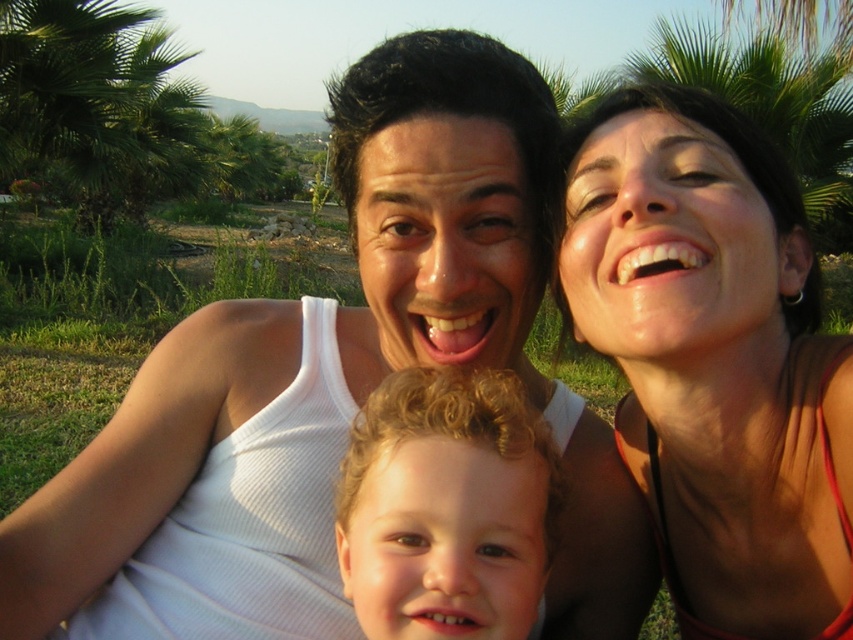
Who is more forward, (68, 515) or (598, 323)?

Point (598, 323) is more forward.

Does white ribbed tank top at center appear over matte red tank top at upper right?

No, white ribbed tank top at center is not above matte red tank top at upper right.

What do you see at coordinates (334, 388) in the screenshot? This screenshot has height=640, width=853. I see `white ribbed tank top at center` at bounding box center [334, 388].

Find the location of a particular element. white ribbed tank top at center is located at coordinates (334, 388).

Can you confirm if matte red tank top at upper right is shorter than curly blonde hair at center?

No, matte red tank top at upper right is not shorter than curly blonde hair at center.

The image size is (853, 640). What do you see at coordinates (715, 358) in the screenshot?
I see `matte red tank top at upper right` at bounding box center [715, 358].

You are a GUI agent. You are given a task and a screenshot of the screen. Output one action in this format:
    pyautogui.click(x=<x>, y=<y>)
    Task: Click on the matte red tank top at upper right
    
    Given the screenshot: What is the action you would take?
    click(x=715, y=358)

Can you confirm if white ribbed tank top at center is bigger than curly blonde hair at center?

Yes.

Who is positioned more to the left, white ribbed tank top at center or curly blonde hair at center?

Positioned to the left is white ribbed tank top at center.

Does point (396, 269) come farther from viewer compared to point (378, 524)?

Yes, it is.

At what (x,y) coordinates should I click in order to perform the action: click on white ribbed tank top at center. Please return your answer as a coordinate pair (x, y). This screenshot has width=853, height=640. Looking at the image, I should click on (334, 388).